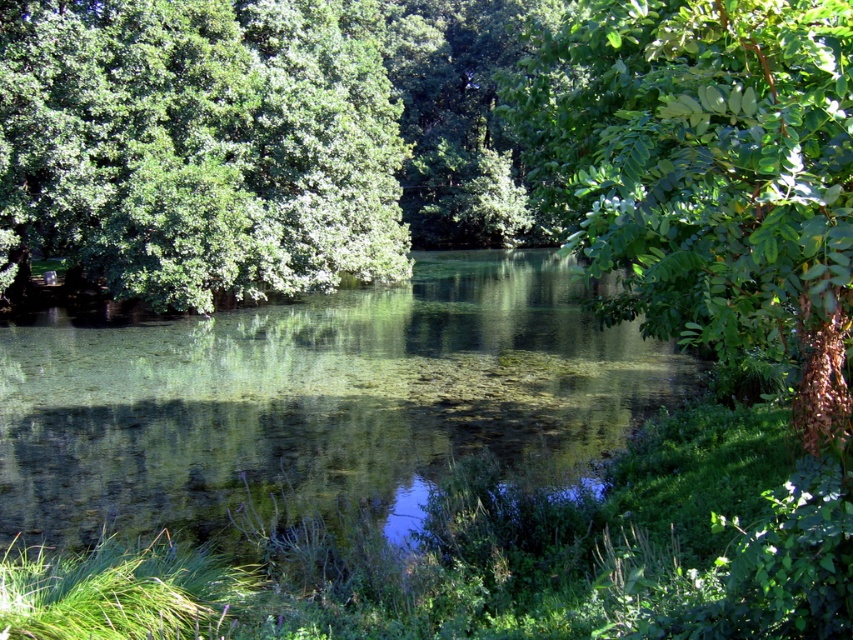
You are an environmental scientist assessing the biodiversity of the area. You observe two green leafy trees in the scene. Which tree has a larger width, the green leafy tree at center or the green leafy tree at upper right?

The green leafy tree at center has a larger width than the green leafy tree at upper right according to the description.

You are a photographer planning to take a wide shot of the scene. You need to ensure that both the clear water at center and the green leafy tree at center are fully visible in the frame. Given their widths, which object should you prioritize positioning closer to the center of your camera frame to avoid cropping?

The clear water at center is wider than the green leafy tree at center. Therefore, you should prioritize positioning the clear water at center closer to the center of your camera frame to ensure it fits without cropping, as it has a greater width.